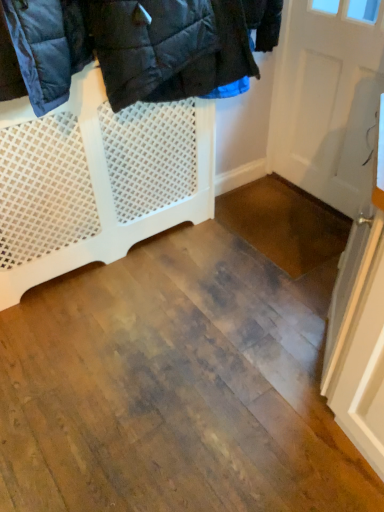
Find the location of a particular element. Image resolution: width=384 pixels, height=512 pixels. vacant area that is in front of white mesh gate at upper left is located at coordinates (132, 350).